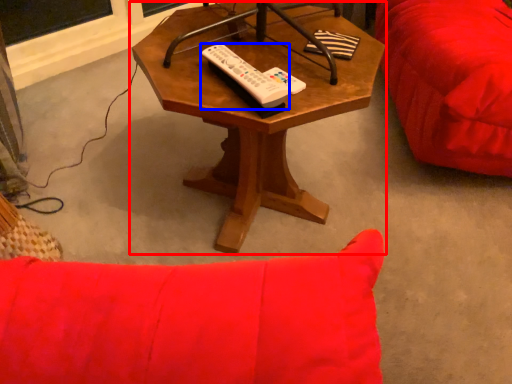
Question: Which of the following is the farthest to the observer, coffee table (highlighted by a red box) or remote (highlighted by a blue box)?

Choices:
 (A) coffee table
 (B) remote

Answer: (B)